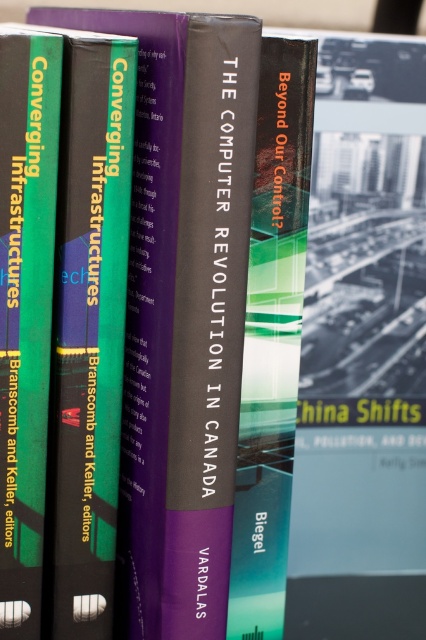
Which is more to the left, green matte book at center or hardcover book at center?

green matte book at center

Does green matte book at center lie behind hardcover book at center?

No, it is in front of hardcover book at center.

Does point (74, 536) lie behind point (299, 214)?

No, it is not.

Image resolution: width=426 pixels, height=640 pixels. Identify the location of green matte book at center. (89, 326).

Can you confirm if hardcover book at center is positioned to the left of green matte book at left?

In fact, hardcover book at center is to the right of green matte book at left.

Between hardcover book at center and green matte book at left, which one is positioned higher?

green matte book at left is above.

Image resolution: width=426 pixels, height=640 pixels. What do you see at coordinates (271, 339) in the screenshot? I see `hardcover book at center` at bounding box center [271, 339].

This screenshot has width=426, height=640. Identify the location of hardcover book at center. (271, 339).

Looking at this image, between green matte book at center and green matte book at left, which one is positioned lower?

green matte book at center

Does green matte book at center have a lesser height compared to green matte book at left?

No, green matte book at center is not shorter than green matte book at left.

You are a GUI agent. You are given a task and a screenshot of the screen. Output one action in this format:
    pyautogui.click(x=<x>, y=<y>)
    Task: Click on the green matte book at center
    This screenshot has width=426, height=640.
    Given the screenshot: What is the action you would take?
    pyautogui.click(x=89, y=326)

This screenshot has width=426, height=640. Identify the location of green matte book at center. (89, 326).